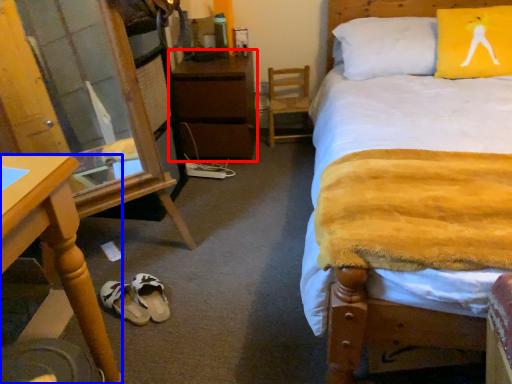
Question: Among these objects, which one is farthest to the camera, nightstand (highlighted by a red box) or desk (highlighted by a blue box)?

Choices:
 (A) nightstand
 (B) desk

Answer: (A)